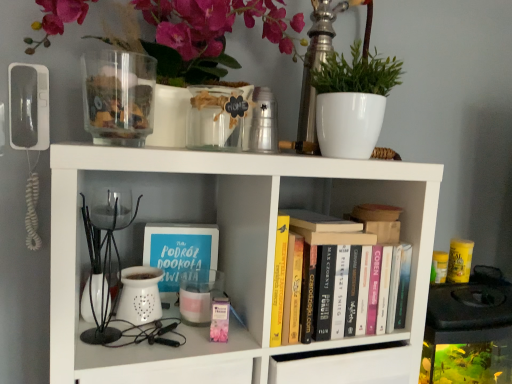
Question: Is white matte bookshelf at center positioned beyond the bounds of white ceramic plant at upper right?

Choices:
 (A) no
 (B) yes

Answer: (B)

Question: Does white matte bookshelf at center have a lesser height compared to white ceramic plant at upper right?

Choices:
 (A) yes
 (B) no

Answer: (B)

Question: Does white matte bookshelf at center have a larger size compared to white ceramic plant at upper right?

Choices:
 (A) yes
 (B) no

Answer: (A)

Question: Is white matte bookshelf at center directly adjacent to white ceramic plant at upper right?

Choices:
 (A) yes
 (B) no

Answer: (B)

Question: Is white ceramic plant at upper right at the back of white matte bookshelf at center?

Choices:
 (A) no
 (B) yes

Answer: (A)

Question: From a real-world perspective, is hardcover books at center physically located above or below matte white vase at upper center?

Choices:
 (A) below
 (B) above

Answer: (A)

Question: Considering their positions, is hardcover books at center located in front of or behind matte white vase at upper center?

Choices:
 (A) front
 (B) behind

Answer: (B)

Question: Visually, is hardcover books at center positioned to the left or to the right of matte white vase at upper center?

Choices:
 (A) left
 (B) right

Answer: (B)

Question: From the image's perspective, is hardcover books at center above or below matte white vase at upper center?

Choices:
 (A) below
 (B) above

Answer: (A)

Question: Is matte white vase at upper center taller or shorter than transparent glass jar at upper left, the second glass vase viewed from the right?

Choices:
 (A) short
 (B) tall

Answer: (B)

Question: Relative to transparent glass jar at upper left, positioned as the first glass vase in left-to-right order, is matte white vase at upper center in front or behind?

Choices:
 (A) behind
 (B) front

Answer: (A)

Question: From a real-world perspective, is matte white vase at upper center above or below transparent glass jar at upper left, positioned as the first glass vase in left-to-right order?

Choices:
 (A) below
 (B) above

Answer: (B)

Question: Considering the positions of matte white vase at upper center and transparent glass jar at upper left, the second glass vase viewed from the right, in the image, is matte white vase at upper center wider or thinner than transparent glass jar at upper left, the second glass vase viewed from the right,?

Choices:
 (A) wide
 (B) thin

Answer: (A)

Question: Do you think matte white vase at upper center is within white matte bookshelf at center, or outside of it?

Choices:
 (A) inside
 (B) outside

Answer: (B)

Question: Does point (139, 3) appear closer or farther from the camera than point (86, 168)?

Choices:
 (A) closer
 (B) farther

Answer: (B)